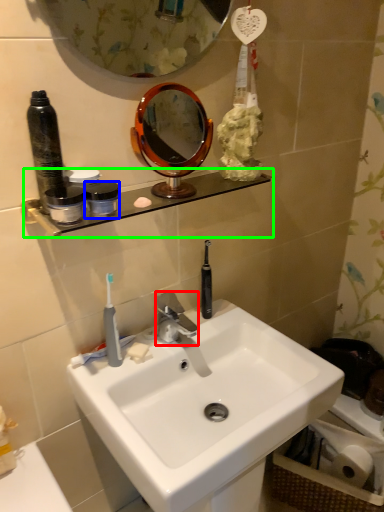
Question: Which object is the farthest from faucet (highlighted by a red box)? Choose among these: coffee cup (highlighted by a blue box) or shelve (highlighted by a green box).

Choices:
 (A) coffee cup
 (B) shelve

Answer: (A)